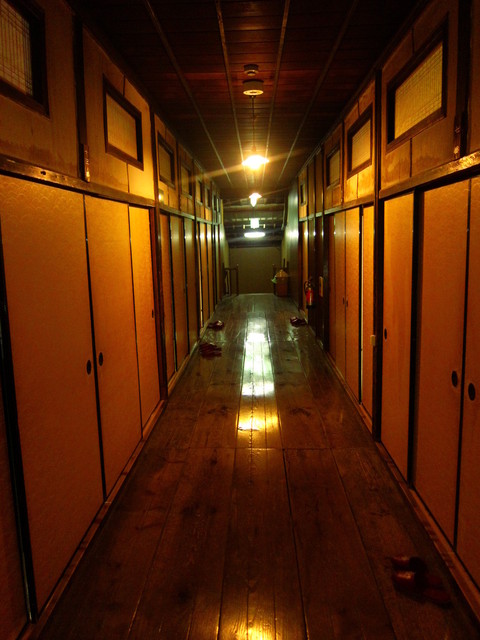
This screenshot has width=480, height=640. What are the coordinates of `windows` in the screenshot? It's located at (12, 45), (124, 137), (162, 161), (185, 180), (197, 189), (333, 166), (366, 145), (400, 100), (304, 194).